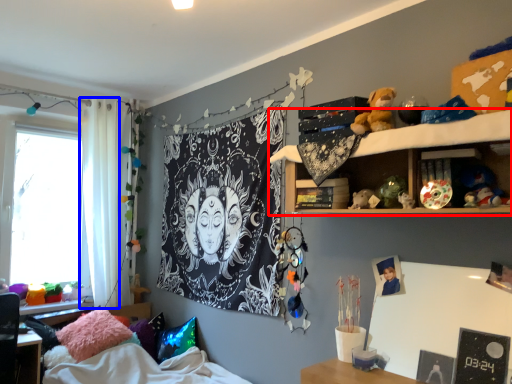
Question: Which object appears farthest to the camera in this image, shelf (highlighted by a red box) or curtain (highlighted by a blue box)?

Choices:
 (A) shelf
 (B) curtain

Answer: (B)